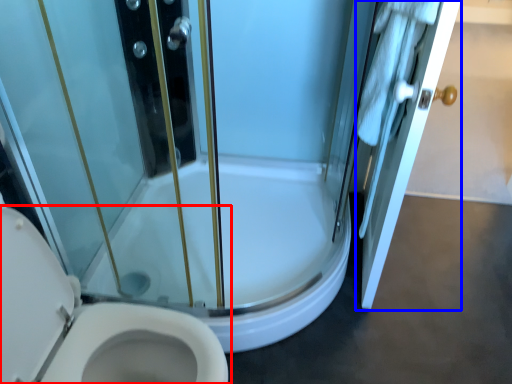
Question: Which of the following is the farthest to the observer, toilet (highlighted by a red box) or door (highlighted by a blue box)?

Choices:
 (A) toilet
 (B) door

Answer: (B)